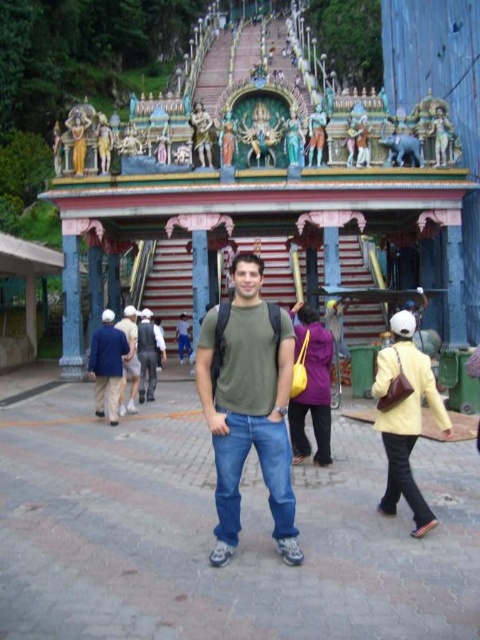
You are a photographer standing at the base of the staircase in the temple. You want to take a photo of the yellow leather jacket at center and the purple fabric bag at center. Which object should you focus on first to ensure both are in the frame?

The yellow leather jacket at center is in front of the purple fabric bag at center, so you should focus on the yellow leather jacket at center first to ensure both are in the frame.

You are standing at the base of the staircase in the temple scene. You see two points marked on the ground ahead of you. The first point is at coordinates point (425, 390) and the second is at point (324, 378). Which point is closer to you?

Point (425, 390) is in front of point (324, 378), so the first point is closer to you.